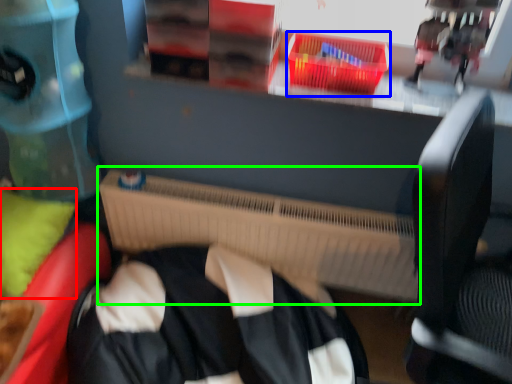
Question: Estimate the real-world distances between objects in this image. Which object is closer to pillow (highlighted by a red box), basket (highlighted by a blue box) or radiator (highlighted by a green box)?

Choices:
 (A) basket
 (B) radiator

Answer: (B)